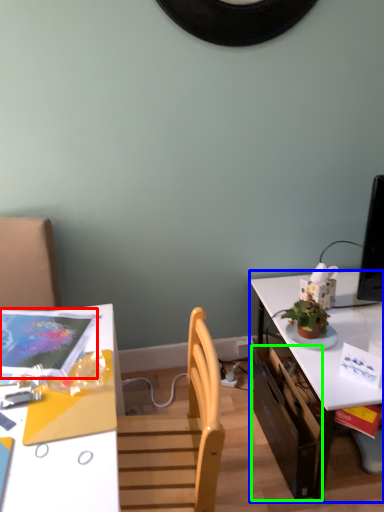
Question: Which object is positioned closest to magazine (highlighted by a red box)? Select from table (highlighted by a blue box) and drawer (highlighted by a green box).

Choices:
 (A) table
 (B) drawer

Answer: (B)